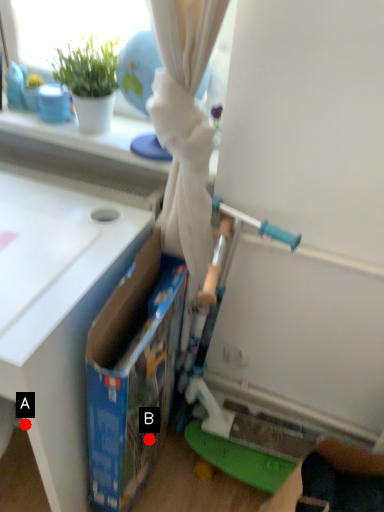
Question: Two points are circled on the image, labeled by A and B beside each circle. Which point is closer to the camera?

Choices:
 (A) A is closer
 (B) B is closer

Answer: (A)